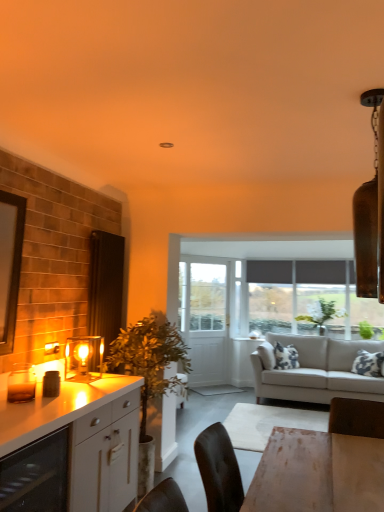
The image size is (384, 512). Describe the element at coordinates (148, 375) in the screenshot. I see `green leafy plant at left` at that location.

What are the coordinates of `white glossy cabinet at left` in the screenshot? It's located at (76, 444).

Identify the location of light gray fabric couch at center. 318,371.

Considering the positions of objects green leafy plant at upper center and light gray fabric couch at center in the image provided, who is more to the left, green leafy plant at upper center or light gray fabric couch at center?

From the viewer's perspective, light gray fabric couch at center appears more on the left side.

Relative to light gray fabric couch at center, is green leafy plant at upper center in front or behind?

Visually, green leafy plant at upper center is located behind light gray fabric couch at center.

Does green leafy plant at upper center contain light gray fabric couch at center?

No, light gray fabric couch at center is not a part of green leafy plant at upper center.

Is green leafy plant at upper center oriented away from light gray fabric couch at center?

No, green leafy plant at upper center's orientation is not away from light gray fabric couch at center.

Are light gray fabric couch at center and matte glass lampshade at left located far from each other?

Yes, light gray fabric couch at center and matte glass lampshade at left are located far from each other.

From the image's perspective, relative to matte glass lampshade at left, is light gray fabric couch at center above or below?

Clearly, from the image's perspective, light gray fabric couch at center is below matte glass lampshade at left.

How far apart are light gray fabric couch at center and matte glass lampshade at left?

light gray fabric couch at center is 9.38 feet from matte glass lampshade at left.

From their relative heights in the image, would you say light gray fabric couch at center is taller or shorter than matte glass lampshade at left?

In the image, light gray fabric couch at center appears to be taller than matte glass lampshade at left.

Is white glossy cabinet at left looking in the opposite direction of green leafy plant at left?

No, white glossy cabinet at left's orientation is not away from green leafy plant at left.

Is there a large distance between white glossy cabinet at left and green leafy plant at left?

No, white glossy cabinet at left is not far from green leafy plant at left.

Is white glossy cabinet at left bigger than green leafy plant at left?

No, white glossy cabinet at left is not bigger than green leafy plant at left.

Which object is closer to the camera, white glossy cabinet at left or green leafy plant at left?

white glossy cabinet at left is in front.

In the scene shown: How many degrees apart are the facing directions of white glossy cabinet at left and white wooden screen door at center?

white glossy cabinet at left and white wooden screen door at center are facing 43.6 degrees away from each other.

How much distance is there between white glossy cabinet at left and white wooden screen door at center?

white glossy cabinet at left is 11.34 feet from white wooden screen door at center.

From the image's perspective, is white glossy cabinet at left located above or below white wooden screen door at center?

white glossy cabinet at left is situated lower than white wooden screen door at center in the image.

Considering the positions of objects white glossy cabinet at left and white wooden screen door at center in the image provided, who is more to the right, white glossy cabinet at left or white wooden screen door at center?

white wooden screen door at center.

Can you confirm if light gray fabric couch at center is positioned to the right of green leafy plant at left?

Correct, you'll find light gray fabric couch at center to the right of green leafy plant at left.

What's the angular difference between light gray fabric couch at center and green leafy plant at left's facing directions?

There is a 92.9-degree angle between the facing directions of light gray fabric couch at center and green leafy plant at left.

Looking at this image, which of these two, light gray fabric couch at center or green leafy plant at left, is thinner?

With smaller width is green leafy plant at left.

Is light gray fabric couch at center inside the boundaries of green leafy plant at left, or outside?

light gray fabric couch at center exists outside the volume of green leafy plant at left.

Which of these two, light gray fabric couch at center or white glossy cabinet at left, stands shorter?

With less height is white glossy cabinet at left.

How many degrees apart are the facing directions of light gray fabric couch at center and white glossy cabinet at left?

89.8 degrees separate the facing orientations of light gray fabric couch at center and white glossy cabinet at left.

From a real-world perspective, which is physically below, light gray fabric couch at center or white glossy cabinet at left?

From a 3D spatial view, white glossy cabinet at left is below.

In terms of width, does green leafy plant at upper center look wider or thinner when compared to green leafy plant at left?

Clearly, green leafy plant at upper center has less width compared to green leafy plant at left.

Is green leafy plant at upper center directly adjacent to green leafy plant at left?

green leafy plant at upper center is not next to green leafy plant at left, and they're not touching.

From the image's perspective, which is below, green leafy plant at upper center or green leafy plant at left?

green leafy plant at left, from the image's perspective.

Considering the relative positions of green leafy plant at upper center and green leafy plant at left in the image provided, is green leafy plant at upper center to the left of green leafy plant at left from the viewer's perspective?

Incorrect, green leafy plant at upper center is not on the left side of green leafy plant at left.

Locate an element on the screen. The width and height of the screenshot is (384, 512). studio couch below the green leafy plant at upper center (from the image's perspective) is located at coordinates (318, 371).

The height and width of the screenshot is (512, 384). In order to click on light fixture on the left of light gray fabric couch at center in this screenshot , I will do `click(84, 358)`.

Looking at this image, considering their positions, is light gray fabric couch at center positioned further to matte glass wine cooler at lower left than white wooden screen door at center?

white wooden screen door at center.

Looking at the image, which one is located closer to light gray fabric couch at center, green leafy plant at left or green leafy plant at upper center?

green leafy plant at upper center is positioned closer to the anchor light gray fabric couch at center.

Considering their positions, is matte glass wine cooler at lower left positioned further to green leafy plant at left than matte glass lampshade at left?

matte glass wine cooler at lower left is positioned further to the anchor green leafy plant at left.

Which object lies nearer to the anchor point white glossy cabinet at left, matte glass wine cooler at lower left or green leafy plant at upper center?

matte glass wine cooler at lower left is positioned closer to the anchor white glossy cabinet at left.

Looking at the image, which one is located closer to matte glass lampshade at left, matte glass wine cooler at lower left or green leafy plant at left?

green leafy plant at left lies closer to matte glass lampshade at left than the other object.

Estimate the real-world distances between objects in this image. Which object is further from white glossy cabinet at left, white wooden screen door at center or matte glass lampshade at left?

white wooden screen door at center.

When comparing their distances from matte glass wine cooler at lower left, does light gray fabric couch at center or white glossy cabinet at left seem closer?

white glossy cabinet at left lies closer to matte glass wine cooler at lower left than the other object.

Based on the photo, which object lies nearer to the anchor point light gray fabric couch at center, matte glass wine cooler at lower left or matte glass lampshade at left?

matte glass lampshade at left lies closer to light gray fabric couch at center than the other object.

Find the location of `studio couch between green leafy plant at left and white wooden screen door at center in the front-back direction`. studio couch between green leafy plant at left and white wooden screen door at center in the front-back direction is located at coordinates (318, 371).

Locate an element on the screen. The image size is (384, 512). houseplant positioned between matte glass lampshade at left and white wooden screen door at center from near to far is located at coordinates (148, 375).

Where is `light fixture between matte glass wine cooler at lower left and green leafy plant at upper center from front to back`? Image resolution: width=384 pixels, height=512 pixels. light fixture between matte glass wine cooler at lower left and green leafy plant at upper center from front to back is located at coordinates (84, 358).

Find the location of a particular element. Image resolution: width=384 pixels, height=512 pixels. cabinetry between matte glass wine cooler at lower left and matte glass lampshade at left along the z-axis is located at coordinates (76, 444).